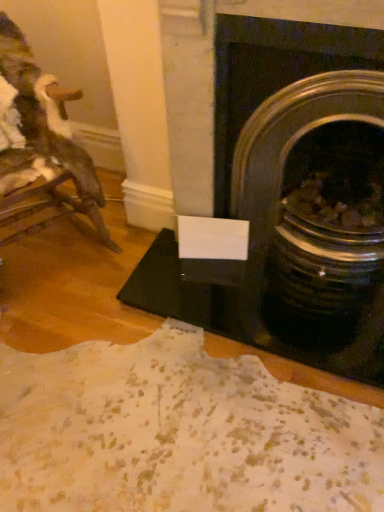
What do you see at coordinates (213, 78) in the screenshot? This screenshot has width=384, height=512. I see `black glossy fireplace at center right` at bounding box center [213, 78].

Image resolution: width=384 pixels, height=512 pixels. I want to click on black glossy fireplace at center right, so click(213, 78).

Measure the distance between point (180, 129) and camera.

5.09 feet.

Find the location of a particular element. The height and width of the screenshot is (512, 384). wooden rocking chair at left is located at coordinates (41, 136).

Describe the element at coordinates (41, 136) in the screenshot. The width and height of the screenshot is (384, 512). I see `wooden rocking chair at left` at that location.

Measure the distance between point (10,134) and camera.

They are 5.93 feet apart.

Where is `black glossy fireplace at center right`? This screenshot has width=384, height=512. black glossy fireplace at center right is located at coordinates (213, 78).

Is wooden rocking chair at left to the right of black glossy fireplace at center right from the viewer's perspective?

No.

Considering their positions, is wooden rocking chair at left located in front of or behind black glossy fireplace at center right?

In the image, wooden rocking chair at left appears in front of black glossy fireplace at center right.

Which is less distant, (58, 138) or (205, 91)?

The point (205, 91) is more forward.

From the image's perspective, is wooden rocking chair at left on top of black glossy fireplace at center right?

Yes, from the image's perspective, wooden rocking chair at left is over black glossy fireplace at center right.

From a real-world perspective, who is located higher, wooden rocking chair at left or black glossy fireplace at center right?

From a 3D spatial view, black glossy fireplace at center right is above.

Considering the relative sizes of wooden rocking chair at left and black glossy fireplace at center right in the image provided, is wooden rocking chair at left thinner than black glossy fireplace at center right?

No, wooden rocking chair at left is not thinner than black glossy fireplace at center right.

Considering the relative sizes of wooden rocking chair at left and black glossy fireplace at center right in the image provided, is wooden rocking chair at left shorter than black glossy fireplace at center right?

No.

Considering the sizes of objects wooden rocking chair at left and black glossy fireplace at center right in the image provided, who is bigger, wooden rocking chair at left or black glossy fireplace at center right?

wooden rocking chair at left.

Is wooden rocking chair at left inside or outside of black glossy fireplace at center right?

wooden rocking chair at left is located beyond the bounds of black glossy fireplace at center right.

Does wooden rocking chair at left touch black glossy fireplace at center right?

wooden rocking chair at left is not next to black glossy fireplace at center right, and they're not touching.

Is wooden rocking chair at left oriented away from black glossy fireplace at center right?

No, wooden rocking chair at left is not facing away from black glossy fireplace at center right.

Can you tell me how much wooden rocking chair at left and black glossy fireplace at center right differ in facing direction?

wooden rocking chair at left and black glossy fireplace at center right are facing 59.8 degrees away from each other.

Locate an element on the screen. The height and width of the screenshot is (512, 384). chair that is in front of the black glossy fireplace at center right is located at coordinates (41, 136).

Considering the relative positions of black glossy fireplace at center right and wooden rocking chair at left in the image provided, is black glossy fireplace at center right to the right of wooden rocking chair at left from the viewer's perspective?

Correct, you'll find black glossy fireplace at center right to the right of wooden rocking chair at left.

Who is more distant, black glossy fireplace at center right or wooden rocking chair at left?

black glossy fireplace at center right is behind.

Does point (170, 0) lie in front of point (18, 127)?

That is True.

Based on the photo, from the image's perspective, is black glossy fireplace at center right beneath wooden rocking chair at left?

Yes, from the image's perspective, black glossy fireplace at center right is below wooden rocking chair at left.

From a real-world perspective, between black glossy fireplace at center right and wooden rocking chair at left, who is vertically lower?

wooden rocking chair at left, from a real-world perspective.

Is black glossy fireplace at center right wider than wooden rocking chair at left?

In fact, black glossy fireplace at center right might be narrower than wooden rocking chair at left.

Does black glossy fireplace at center right have a lesser height compared to wooden rocking chair at left?

Yes, black glossy fireplace at center right is shorter than wooden rocking chair at left.

Between black glossy fireplace at center right and wooden rocking chair at left, which one has larger size?

Bigger between the two is wooden rocking chair at left.

Is black glossy fireplace at center right surrounding wooden rocking chair at left?

No, wooden rocking chair at left is not inside black glossy fireplace at center right.

Are black glossy fireplace at center right and wooden rocking chair at left far apart?

No, black glossy fireplace at center right is in close proximity to wooden rocking chair at left.

Looking at this image, is black glossy fireplace at center right looking in the opposite direction of wooden rocking chair at left?

No.

In order to click on chair above the black glossy fireplace at center right (from the image's perspective) in this screenshot , I will do `click(41, 136)`.

In the image, there is a black glossy fireplace at center right. At what (x,y) coordinates should I click in order to perform the action: click on chair above it (from the image's perspective). Please return your answer as a coordinate pair (x, y). The image size is (384, 512). Looking at the image, I should click on (41, 136).

In order to click on chair that appears in front of the black glossy fireplace at center right in this screenshot , I will do `click(41, 136)`.